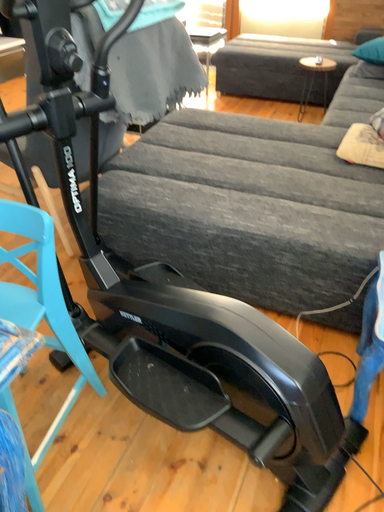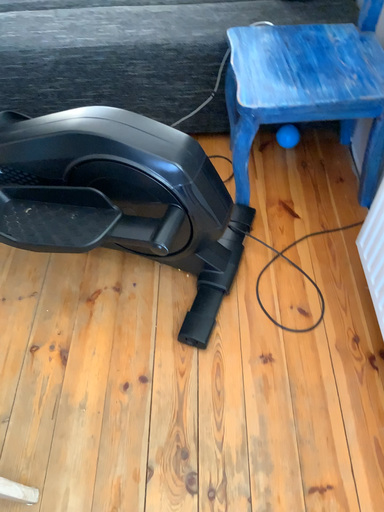
Question: How did the camera likely rotate when shooting the video?

Choices:
 (A) rotated left
 (B) rotated right

Answer: (B)